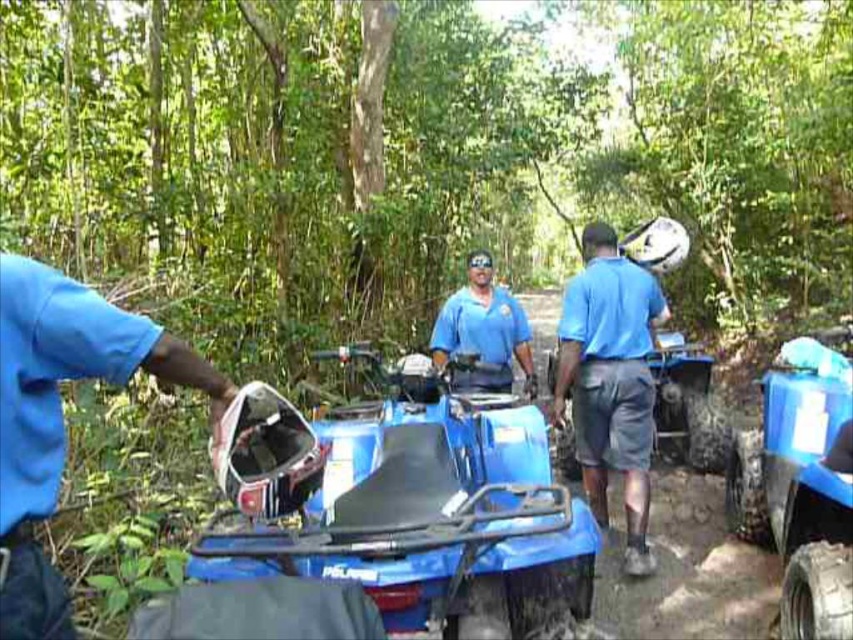
Which is above, blue plastic motorcycle at center or blue matte helmet at left?

blue matte helmet at left

Is blue plastic motorcycle at center closer to the viewer compared to blue matte helmet at left?

That is False.

Who is more forward, (535, 449) or (1, 596)?

Point (1, 596) is in front.

Where is `blue plastic motorcycle at center`? blue plastic motorcycle at center is located at coordinates (433, 518).

Can you confirm if blue plastic motorcycle at center is positioned below matte blue shirt at center?

Yes, blue plastic motorcycle at center is below matte blue shirt at center.

Can you confirm if blue plastic motorcycle at center is taller than matte blue shirt at center?

Incorrect, blue plastic motorcycle at center's height is not larger of matte blue shirt at center's.

The height and width of the screenshot is (640, 853). Describe the element at coordinates (433, 518) in the screenshot. I see `blue plastic motorcycle at center` at that location.

What are the coordinates of `blue plastic motorcycle at center` in the screenshot? It's located at (433, 518).

Is blue matte helmet at left taller than blue fabric shorts at center?

No, blue matte helmet at left is not taller than blue fabric shorts at center.

From the picture: Does blue matte helmet at left appear on the left side of blue fabric shorts at center?

Correct, you'll find blue matte helmet at left to the left of blue fabric shorts at center.

Does point (24, 525) lie in front of point (590, 385)?

Yes.

At what (x,y) coordinates should I click in order to perform the action: click on blue matte helmet at left. Please return your answer as a coordinate pair (x, y). Looking at the image, I should click on [x=61, y=416].